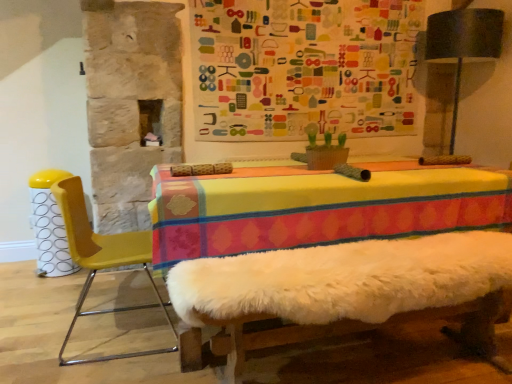
You are a GUI agent. You are given a task and a screenshot of the screen. Output one action in this format:
    pyautogui.click(x=<x>, y=<y>)
    Task: Click on the yellow plastic chair at left
    The height and width of the screenshot is (384, 512).
    Given the screenshot: What is the action you would take?
    pos(101,259)

From the image's perspective, relative to multicolored fabric bulletin board at upper center, is yellow plastic bar stool at left above or below?

From the image's perspective, yellow plastic bar stool at left appears below multicolored fabric bulletin board at upper center.

Is yellow plastic bar stool at left inside or outside of multicolored fabric bulletin board at upper center?

yellow plastic bar stool at left is spatially situated outside multicolored fabric bulletin board at upper center.

The image size is (512, 384). Identify the location of bar stool that appears below the multicolored fabric bulletin board at upper center (from the image's perspective). (49, 225).

From the picture: Does yellow plastic bar stool at left lie in front of multicolored fabric bulletin board at upper center?

Yes, yellow plastic bar stool at left is closer to the viewer.

Can you see yellow plastic chair at left touching multicolored fabric bulletin board at upper center?

No, yellow plastic chair at left is not touching multicolored fabric bulletin board at upper center.

From the image's perspective, which object appears higher, yellow plastic chair at left or multicolored fabric bulletin board at upper center?

multicolored fabric bulletin board at upper center.

Considering the sizes of objects yellow plastic chair at left and multicolored fabric bulletin board at upper center in the image provided, who is smaller, yellow plastic chair at left or multicolored fabric bulletin board at upper center?

multicolored fabric bulletin board at upper center.

Which of these two, yellow plastic chair at left or multicolored fabric bulletin board at upper center, is thinner?

With smaller width is multicolored fabric bulletin board at upper center.

Considering the sizes of objects white fluffy bed frame at center and yellow plastic chair at left in the image provided, who is smaller, white fluffy bed frame at center or yellow plastic chair at left?

yellow plastic chair at left.

Can you see white fluffy bed frame at center touching yellow plastic chair at left?

white fluffy bed frame at center and yellow plastic chair at left are clearly separated.

Identify the location of bed frame on the right of yellow plastic chair at left. (349, 290).

Can you confirm if white fluffy bed frame at center is wider than yellow plastic chair at left?

Yes, white fluffy bed frame at center is wider than yellow plastic chair at left.

From a real-world perspective, which object stands above the other?

yellow plastic chair at left is physically above.

Locate an element on the screen. The width and height of the screenshot is (512, 384). bar stool located on the left of yellow plastic chair at left is located at coordinates (49, 225).

Is there a large distance between yellow plastic bar stool at left and yellow plastic chair at left?

No, yellow plastic bar stool at left is not far away from yellow plastic chair at left.

From the image's perspective, who appears lower, yellow plastic chair at left or yellow plastic bar stool at left?

yellow plastic chair at left.

Considering the positions of points (82, 290) and (35, 177), is point (82, 290) closer to camera compared to point (35, 177)?

Yes.

Between yellow plastic chair at left and yellow plastic bar stool at left, which one is positioned in front?

yellow plastic chair at left is in front.

Is white fluffy bed frame at center closer to camera compared to multicolored fabric bulletin board at upper center?

That is True.

Is white fluffy bed frame at center facing away from multicolored fabric bulletin board at upper center?

white fluffy bed frame at center does not have its back to multicolored fabric bulletin board at upper center.

Between white fluffy bed frame at center and multicolored fabric bulletin board at upper center, which one has smaller size?

Smaller between the two is multicolored fabric bulletin board at upper center.

From a real-world perspective, between white fluffy bed frame at center and multicolored fabric bulletin board at upper center, who is vertically lower?

From a 3D spatial view, white fluffy bed frame at center is below.

Is white fluffy bed frame at center facing away from yellow plastic bar stool at left?

No, white fluffy bed frame at center's orientation is not away from yellow plastic bar stool at left.

Can you see white fluffy bed frame at center touching yellow plastic bar stool at left?

No, white fluffy bed frame at center is not touching yellow plastic bar stool at left.

Is point (370, 257) positioned before point (41, 263)?

Yes.

I want to click on bed frame below the yellow plastic bar stool at left (from a real-world perspective), so click(x=349, y=290).

I want to click on bulletin board behind the yellow plastic bar stool at left, so click(304, 68).

The image size is (512, 384). What are the coordinates of `chair in front of the multicolored fabric bulletin board at upper center` in the screenshot? It's located at (101, 259).

Estimate the real-world distances between objects in this image. Which object is further from white fluffy bed frame at center, yellow plastic chair at left or yellow plastic bar stool at left?

yellow plastic bar stool at left.

Considering their positions, is white fluffy bed frame at center positioned closer to yellow plastic bar stool at left than yellow plastic chair at left?

yellow plastic chair at left.

From the image, which object appears to be nearer to multicolored fabric bulletin board at upper center, yellow plastic bar stool at left or white fluffy bed frame at center?

The object closer to multicolored fabric bulletin board at upper center is white fluffy bed frame at center.

Estimate the real-world distances between objects in this image. Which object is further from multicolored fabric bulletin board at upper center, yellow plastic chair at left or yellow plastic bar stool at left?

yellow plastic chair at left is further to multicolored fabric bulletin board at upper center.

Which object lies further to the anchor point white fluffy bed frame at center, yellow plastic chair at left or multicolored fabric bulletin board at upper center?

multicolored fabric bulletin board at upper center is further to white fluffy bed frame at center.

Estimate the real-world distances between objects in this image. Which object is closer to white fluffy bed frame at center, yellow plastic bar stool at left or yellow plastic chair at left?

yellow plastic chair at left is closer to white fluffy bed frame at center.

Looking at the image, which one is located closer to multicolored fabric bulletin board at upper center, yellow plastic chair at left or white fluffy bed frame at center?

white fluffy bed frame at center is closer to multicolored fabric bulletin board at upper center.

From the image, which object appears to be nearer to yellow plastic bar stool at left, multicolored fabric bulletin board at upper center or yellow plastic chair at left?

Among the two, yellow plastic chair at left is located nearer to yellow plastic bar stool at left.

At what (x,y) coordinates should I click in order to perform the action: click on bar stool between white fluffy bed frame at center and multicolored fabric bulletin board at upper center along the z-axis. Please return your answer as a coordinate pair (x, y). The width and height of the screenshot is (512, 384). Looking at the image, I should click on (49, 225).

Where is `chair between white fluffy bed frame at center and yellow plastic bar stool at left from front to back`? Image resolution: width=512 pixels, height=384 pixels. chair between white fluffy bed frame at center and yellow plastic bar stool at left from front to back is located at coordinates (101, 259).

The image size is (512, 384). In order to click on chair located between yellow plastic bar stool at left and multicolored fabric bulletin board at upper center in the left-right direction in this screenshot , I will do `click(101, 259)`.

The image size is (512, 384). Find the location of `chair between white fluffy bed frame at center and multicolored fabric bulletin board at upper center along the z-axis`. chair between white fluffy bed frame at center and multicolored fabric bulletin board at upper center along the z-axis is located at coordinates (101, 259).